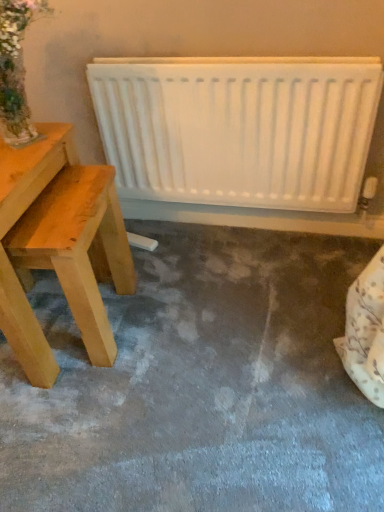
Question: Considering the relative sizes of light wood table at left and white matte radiator at upper center in the image provided, is light wood table at left thinner than white matte radiator at upper center?

Choices:
 (A) yes
 (B) no

Answer: (B)

Question: From a real-world perspective, is light wood table at left beneath white matte radiator at upper center?

Choices:
 (A) yes
 (B) no

Answer: (A)

Question: Does light wood table at left have a smaller size compared to white matte radiator at upper center?

Choices:
 (A) yes
 (B) no

Answer: (B)

Question: Is light wood table at left outside of white matte radiator at upper center?

Choices:
 (A) no
 (B) yes

Answer: (B)

Question: Is light wood table at left further to the viewer compared to white matte radiator at upper center?

Choices:
 (A) no
 (B) yes

Answer: (A)

Question: Is light wood table at left at the left side of white matte radiator at upper center?

Choices:
 (A) no
 (B) yes

Answer: (B)

Question: Considering the relative sizes of white matte radiator at upper center and light wood table at left in the image provided, is white matte radiator at upper center bigger than light wood table at left?

Choices:
 (A) yes
 (B) no

Answer: (B)

Question: Can you confirm if white matte radiator at upper center is positioned to the right of light wood table at left?

Choices:
 (A) no
 (B) yes

Answer: (B)

Question: Is white matte radiator at upper center looking in the opposite direction of light wood table at left?

Choices:
 (A) no
 (B) yes

Answer: (A)

Question: Is the surface of white matte radiator at upper center in direct contact with light wood table at left?

Choices:
 (A) yes
 (B) no

Answer: (B)

Question: From the image's perspective, is white matte radiator at upper center on top of light wood table at left?

Choices:
 (A) yes
 (B) no

Answer: (A)

Question: Is white matte radiator at upper center positioned beyond the bounds of light wood table at left?

Choices:
 (A) yes
 (B) no

Answer: (A)

Question: In terms of height, does white matte radiator at upper center look taller or shorter compared to light wood table at left?

Choices:
 (A) tall
 (B) short

Answer: (B)